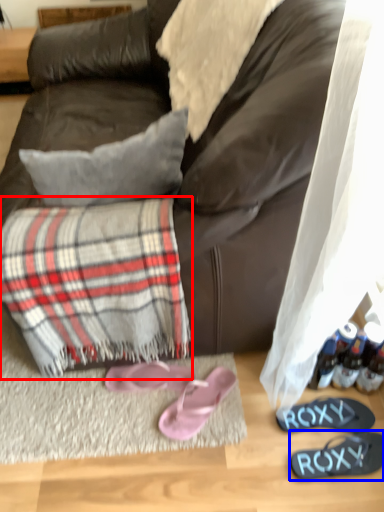
Question: Which object appears farthest to the camera in this image, flannel (highlighted by a red box) or footwear (highlighted by a blue box)?

Choices:
 (A) flannel
 (B) footwear

Answer: (B)